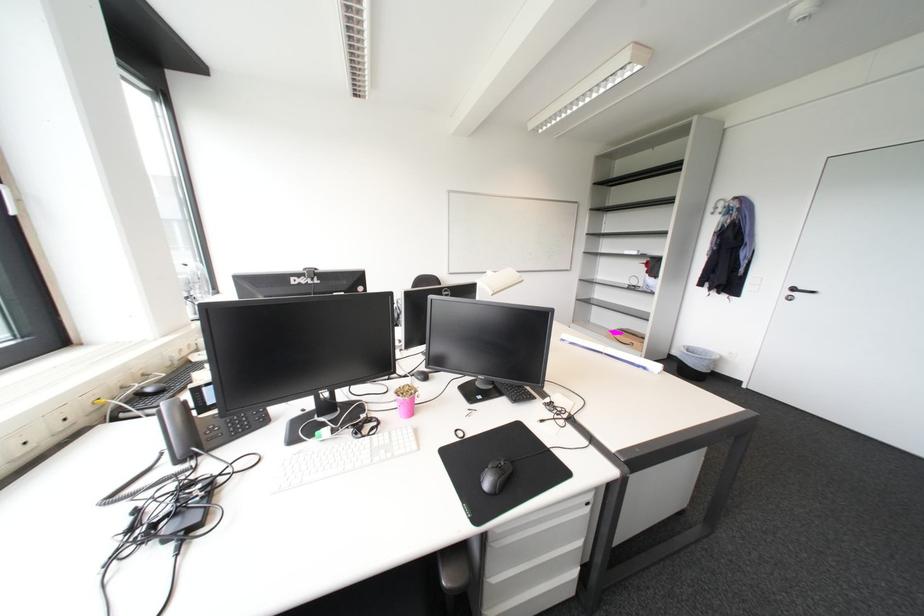
Where would you lift the black trash can? Please return your answer as a coordinate pair (x, y).

(695, 362)